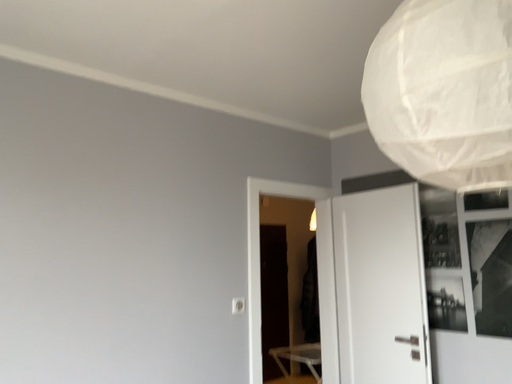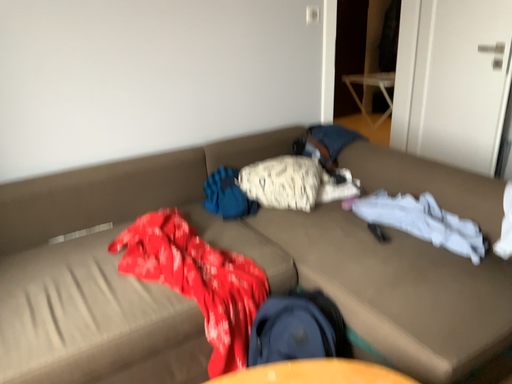
Question: How did the camera likely rotate when shooting the video?

Choices:
 (A) rotated right
 (B) rotated left

Answer: (B)